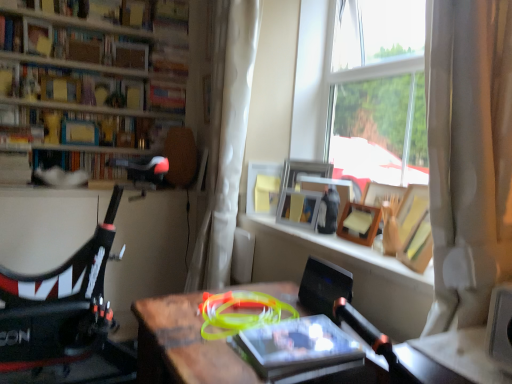
The width and height of the screenshot is (512, 384). In order to click on blank space to the left of translucent plastic book at center, which is the 5th book in back-to-front order in this screenshot , I will do `click(199, 357)`.